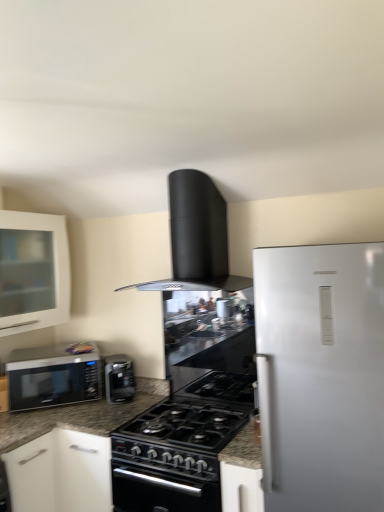
Question: Is black matte range hood at upper center closer to the viewer compared to satin black microwave at left?

Choices:
 (A) no
 (B) yes

Answer: (B)

Question: Is black matte range hood at upper center at the right side of satin black microwave at left?

Choices:
 (A) no
 (B) yes

Answer: (B)

Question: Is the depth of black matte range hood at upper center greater than that of satin black microwave at left?

Choices:
 (A) yes
 (B) no

Answer: (B)

Question: Considering the relative positions of black matte range hood at upper center and satin black microwave at left in the image provided, is black matte range hood at upper center to the left of satin black microwave at left from the viewer's perspective?

Choices:
 (A) no
 (B) yes

Answer: (A)

Question: From a real-world perspective, is black matte range hood at upper center physically below satin black microwave at left?

Choices:
 (A) no
 (B) yes

Answer: (A)

Question: Does black matte range hood at upper center have a lesser width compared to satin black microwave at left?

Choices:
 (A) yes
 (B) no

Answer: (B)

Question: Is satin black coffee maker at center next to satin black microwave at left?

Choices:
 (A) no
 (B) yes

Answer: (A)

Question: Is the position of satin black coffee maker at center more distant than that of satin black microwave at left?

Choices:
 (A) no
 (B) yes

Answer: (B)

Question: Is satin black microwave at left at the back of satin black coffee maker at center?

Choices:
 (A) no
 (B) yes

Answer: (A)

Question: Considering the relative sizes of satin black coffee maker at center and satin black microwave at left in the image provided, is satin black coffee maker at center thinner than satin black microwave at left?

Choices:
 (A) no
 (B) yes

Answer: (B)

Question: Considering the relative positions of satin black coffee maker at center and satin black microwave at left in the image provided, is satin black coffee maker at center to the right of satin black microwave at left from the viewer's perspective?

Choices:
 (A) no
 (B) yes

Answer: (B)

Question: From a real-world perspective, is satin black coffee maker at center physically above satin black microwave at left?

Choices:
 (A) no
 (B) yes

Answer: (A)

Question: Is satin black microwave at left facing towards satin black coffee maker at center?

Choices:
 (A) no
 (B) yes

Answer: (A)